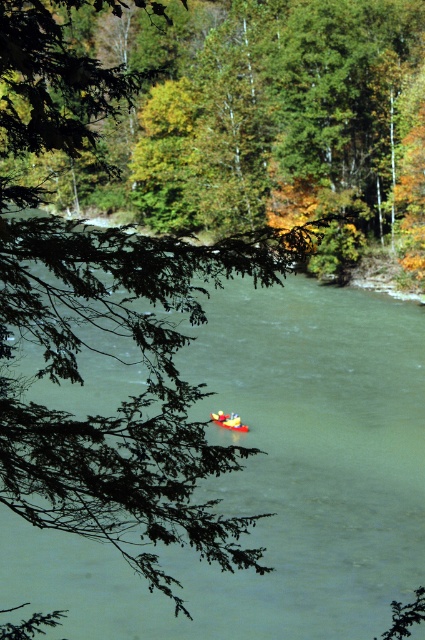
Question: Among these objects, which one is nearest to the camera?

Choices:
 (A) yellow plastic kayak at center
 (B) bright yellow plastic boat at center

Answer: (A)

Question: Does yellow plastic kayak at center have a greater width compared to bright yellow plastic boat at center?

Choices:
 (A) no
 (B) yes

Answer: (B)

Question: From the image, what is the correct spatial relationship of yellow plastic kayak at center in relation to bright yellow plastic boat at center?

Choices:
 (A) above
 (B) below

Answer: (A)

Question: Which point appears farthest from the camera in this image?

Choices:
 (A) (195, 541)
 (B) (214, 420)

Answer: (B)

Question: Can you confirm if yellow plastic kayak at center is bigger than bright yellow plastic boat at center?

Choices:
 (A) no
 (B) yes

Answer: (B)